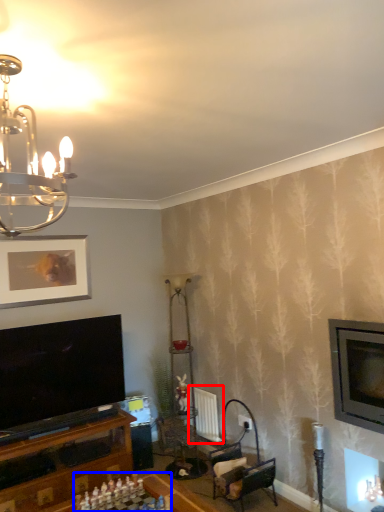
Question: Which of the following is the farthest to the observer, radiator (highlighted by a red box) or board game (highlighted by a blue box)?

Choices:
 (A) radiator
 (B) board game

Answer: (A)